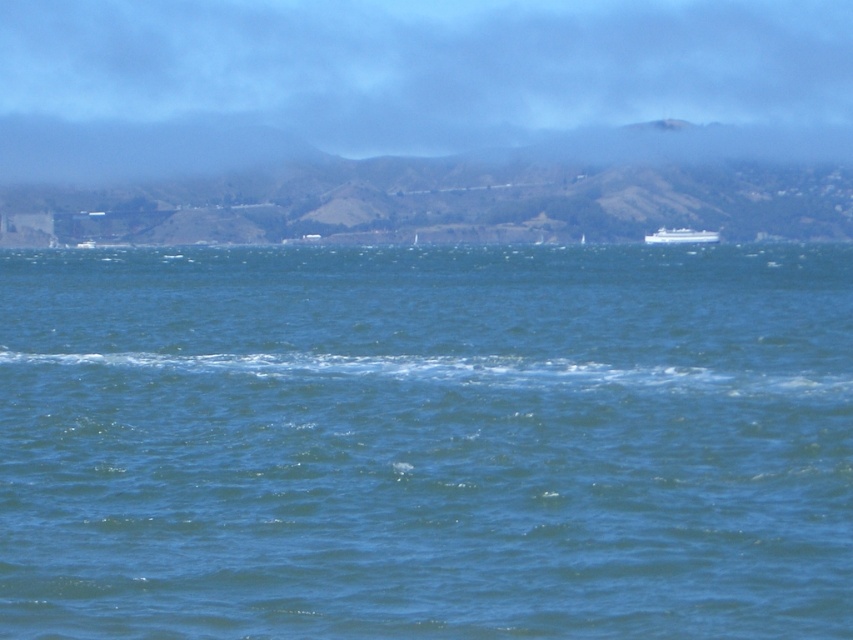
Question: Is green grassy hill at center smaller than white glossy cruise ship at center?

Choices:
 (A) no
 (B) yes

Answer: (A)

Question: From the image, what is the correct spatial relationship of green grassy hill at center in relation to white glossy cruise ship at center?

Choices:
 (A) below
 (B) above

Answer: (B)

Question: Which of these objects is positioned farthest from the blue liquid water at center?

Choices:
 (A) white glossy cruise ship at center
 (B) green grassy hill at center

Answer: (B)

Question: Which of these objects is positioned closest to the blue liquid water at center?

Choices:
 (A) white glossy cruise ship at center
 (B) green grassy hill at center

Answer: (A)

Question: Which point is farther to the camera?

Choices:
 (A) (808, 150)
 (B) (759, 376)

Answer: (A)

Question: Can you confirm if blue liquid water at center is positioned to the left of green grassy hill at center?

Choices:
 (A) no
 (B) yes

Answer: (A)